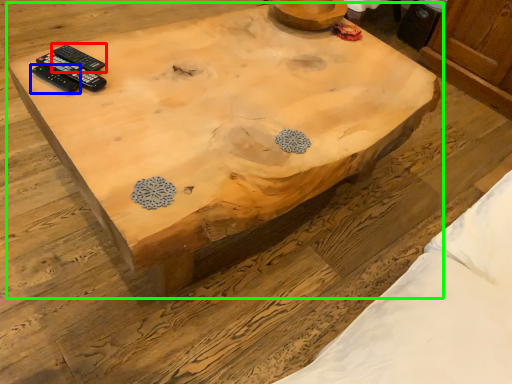
Question: Considering the real-world distances, which object is closest to remote control (highlighted by a red box)? remote control (highlighted by a blue box) or coffee table (highlighted by a green box).

Choices:
 (A) remote control
 (B) coffee table

Answer: (A)